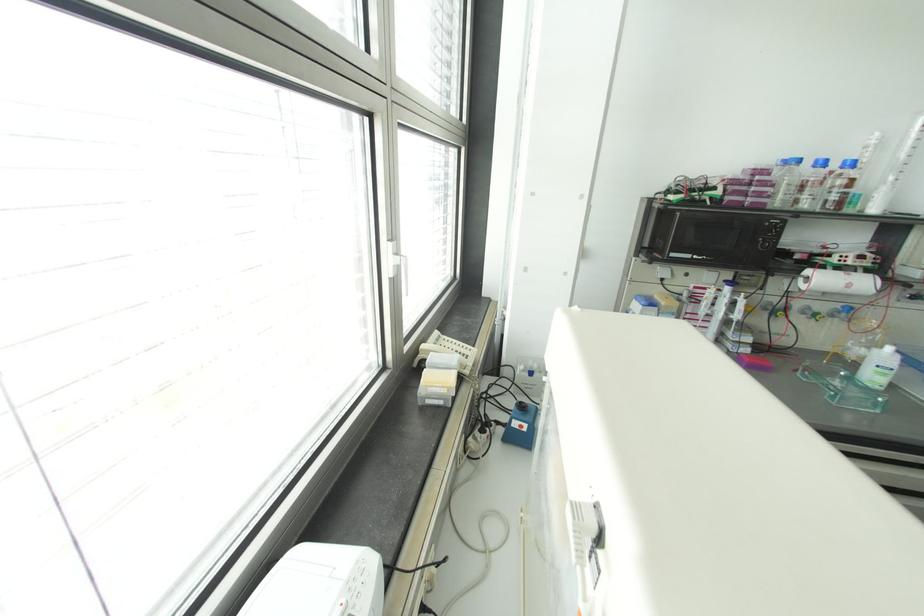
The width and height of the screenshot is (924, 616). Find the location of `telephone handset`. telephone handset is located at coordinates (447, 351).